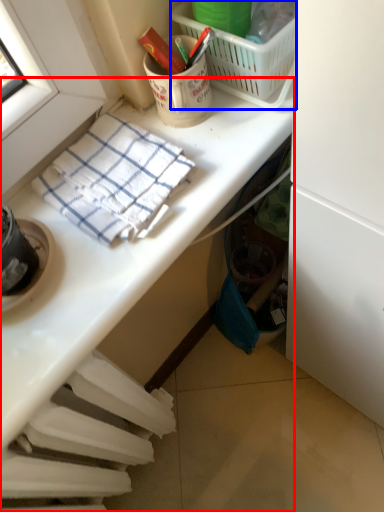
Question: Which point is further to the camera, desk (highlighted by a red box) or picnic basket (highlighted by a blue box)?

Choices:
 (A) desk
 (B) picnic basket

Answer: (B)